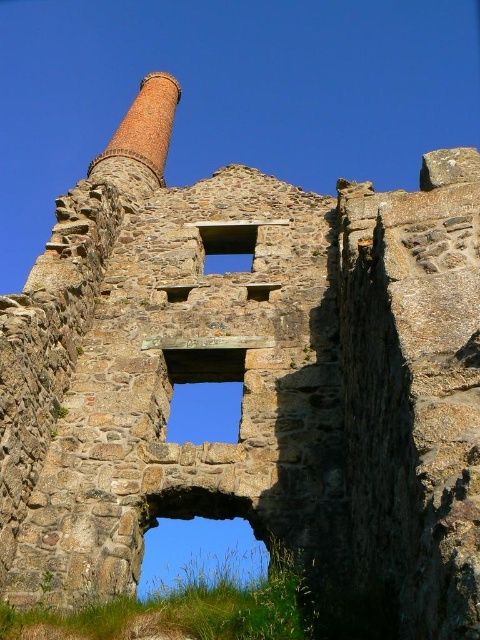
You are standing in front of the ruins of a stone structure. There is a transparent stone window at center. Where is the point at coordinates (204, 394) located?

The point at coordinates (204, 394) is located on the transparent stone window at center.

You are an architect examining the ruins and need to determine the spatial relationship between the transparent stone window at center and the blue glass window at center. Which window has a larger width according to the available information?

The transparent stone window at center is wider than the blue glass window at center according to the description.

You are standing at the entrance of the ruins and want to walk towards the point labeled as point [215,244]. If you move forward, will you pass by the point labeled as point [173,115]?

Yes, you will pass by the point labeled as point [173,115] because it is behind point [215,244], meaning it is further along your path.